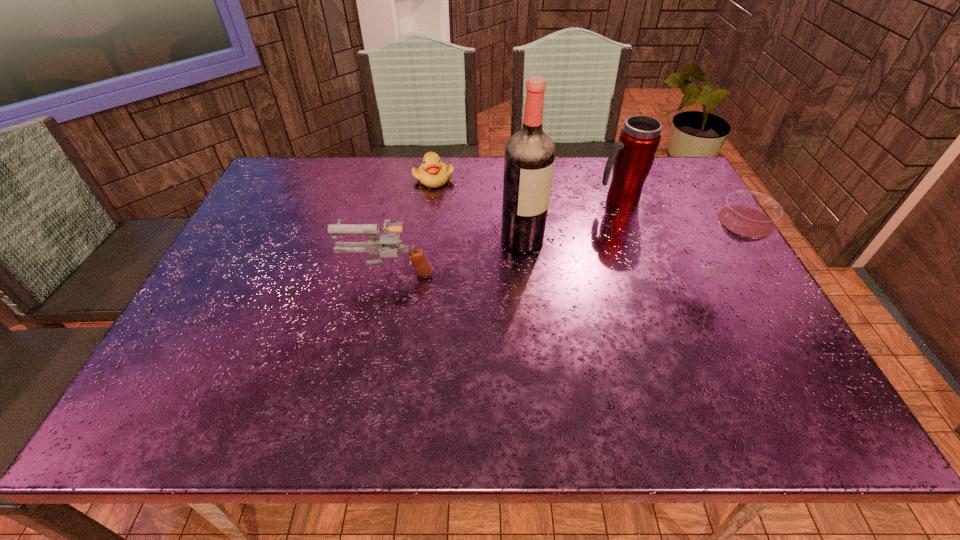
Identify the location of empty space between the shortest object and the third object from left to right. (478, 209).

Image resolution: width=960 pixels, height=540 pixels. Find the location of `vacant region between the shortest object and the gun`. vacant region between the shortest object and the gun is located at coordinates coord(411,224).

Find the location of a particular element. The image size is (960, 540). vacant region between the fourth tallest object and the third shortest object is located at coordinates (554, 271).

I want to click on vacant area between the rightmost object and the second shortest object, so click(554, 271).

Identify the location of free spot between the gun and the liquor. Image resolution: width=960 pixels, height=540 pixels. (456, 254).

The height and width of the screenshot is (540, 960). What are the coordinates of `empty space between the gun and the third tallest object` in the screenshot? It's located at (554, 271).

The height and width of the screenshot is (540, 960). Find the location of `vacant space in between the duckling and the third object from right to left`. vacant space in between the duckling and the third object from right to left is located at coordinates (478, 209).

This screenshot has height=540, width=960. In order to click on vacant area that lies between the farthest object and the tallest object in this screenshot , I will do click(x=478, y=209).

Identify the location of vacant area that lies between the liquor and the thermos bottle. Image resolution: width=960 pixels, height=540 pixels. (570, 220).

Where is `free space between the wineglass and the second shortest object`? The image size is (960, 540). free space between the wineglass and the second shortest object is located at coordinates (554, 271).